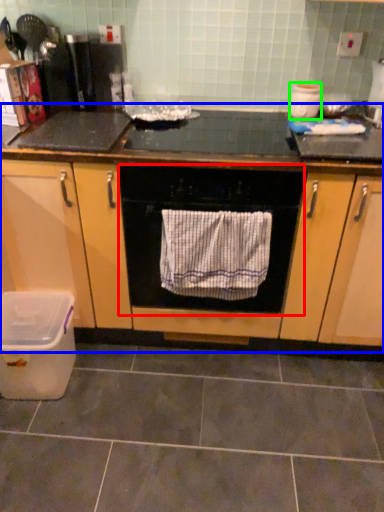
Question: Which is farther away from home appliance (highlighted by a red box)? cabinetry (highlighted by a blue box) or appliance (highlighted by a green box)?

Choices:
 (A) cabinetry
 (B) appliance

Answer: (B)